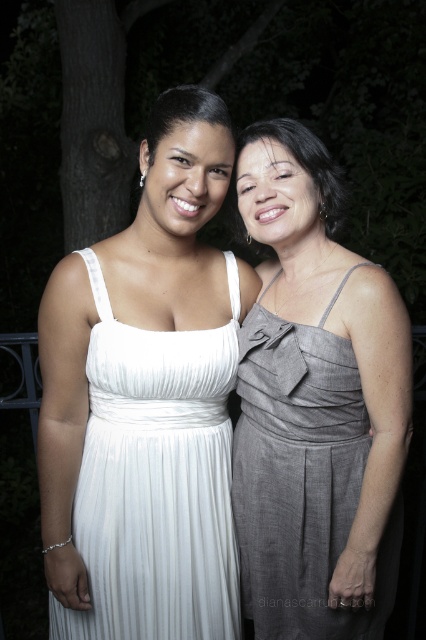
You are a photographer at a formal event. You need to capture a photo of the white pleated dress at left and the gray textured dress at center. Based on their heights, which dress should you adjust your camera angle to focus on first to ensure both are in frame?

The white pleated dress at left is taller than the gray textured dress at center, so you should focus on the white pleated dress at left first to ensure both are in frame.

You are a photographer at a social event. You want to capture a photo of both the white pleated dress at left and the gray textured dress at center in the same frame. The minimum distance required between the dresses to fit both in the frame is 6 inches. Can you fit them in the frame?

The white pleated dress at left is 6.16 inches from the gray textured dress at center, which is just over the minimum required distance of 6 inches. Therefore, both dresses can fit within the frame.